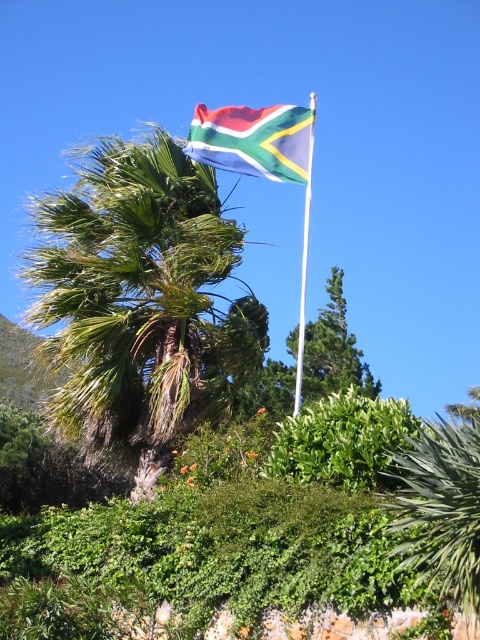
Who is lower down, polyester flag at upper center or white metallic pole at upper center?

Positioned lower is white metallic pole at upper center.

Is polyester flag at upper center above white metallic pole at upper center?

Yes.

What do you see at coordinates (253, 140) in the screenshot? I see `polyester flag at upper center` at bounding box center [253, 140].

Locate an element on the screen. Image resolution: width=480 pixels, height=640 pixels. polyester flag at upper center is located at coordinates (253, 140).

Who is positioned more to the left, green leafy palm at upper center or green leafy tree at center?

From the viewer's perspective, green leafy palm at upper center appears more on the left side.

Between green leafy palm at upper center and green leafy tree at center, which one has less height?

Standing shorter between the two is green leafy tree at center.

Which is in front, point (129, 371) or point (334, 314)?

Positioned in front is point (129, 371).

Locate an element on the screen. The width and height of the screenshot is (480, 640). green leafy palm at upper center is located at coordinates (141, 300).

Is point (304, 388) more distant than point (300, 355)?

Yes, it is.

Does point (335, 328) lie in front of point (301, 339)?

No, (335, 328) is further to viewer.

Is point (354, 385) farther from viewer compared to point (308, 243)?

No, it is in front of (308, 243).

Find the location of `green leafy tree at center`. green leafy tree at center is located at coordinates (334, 349).